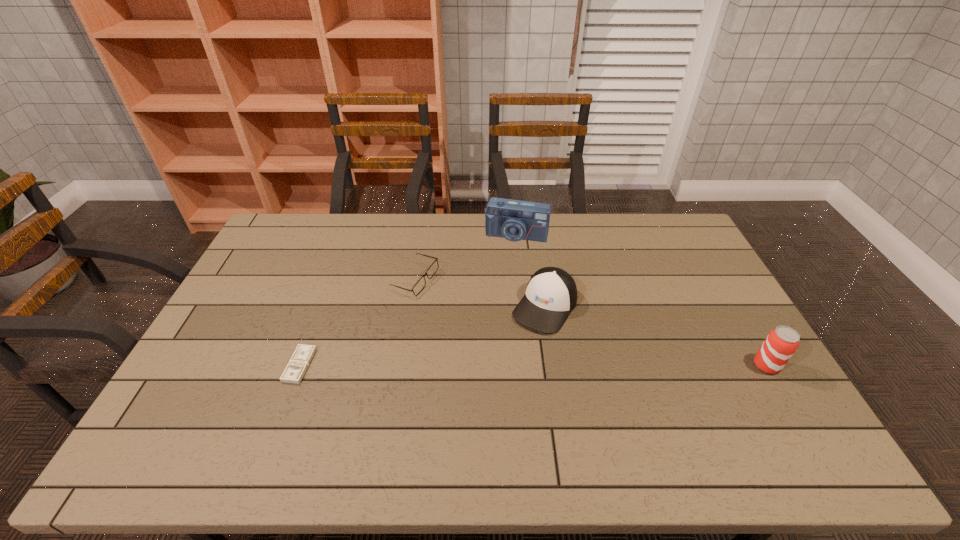
The height and width of the screenshot is (540, 960). What are the coordinates of `vacant space that satisfies the following two spatial constraints: 1. on the front side of the camera; 2. on the right side of the cap` in the screenshot? It's located at (524, 307).